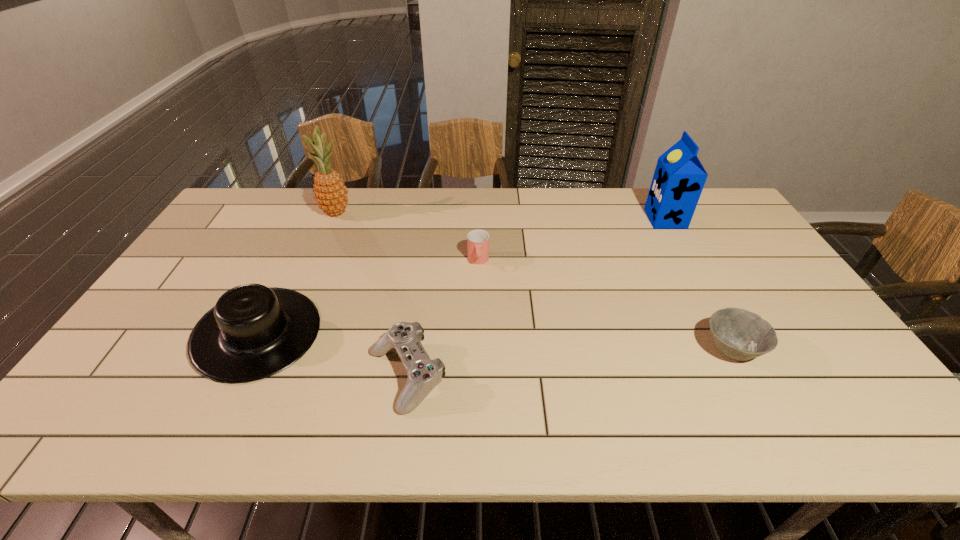
Where is `free spot at the right edge of the desktop`? free spot at the right edge of the desktop is located at coordinates (752, 242).

Where is `unoccupied position between the carton and the third object from right to left`? This screenshot has width=960, height=540. unoccupied position between the carton and the third object from right to left is located at coordinates tap(572, 240).

This screenshot has height=540, width=960. I want to click on free space between the dress hat and the fourth object from right to left, so click(332, 355).

Where is `vacant region between the dress hat and the bowl`? vacant region between the dress hat and the bowl is located at coordinates (495, 341).

Identify the location of vacant space in between the bowl and the control. The image size is (960, 540). (569, 363).

Identify the location of free space between the pineapple and the bowl. The image size is (960, 540). (534, 281).

I want to click on unoccupied area between the dress hat and the bowl, so click(x=495, y=341).

Locate an element on the screen. The width and height of the screenshot is (960, 540). vacant area that lies between the bowl and the third farthest object is located at coordinates (605, 305).

Locate an element on the screen. free space between the bowl and the control is located at coordinates (569, 363).

At what (x,y) coordinates should I click in order to perform the action: click on empty space between the carton and the fourth shortest object. Please return your answer as a coordinate pair (x, y). The height and width of the screenshot is (540, 960). Looking at the image, I should click on (462, 276).